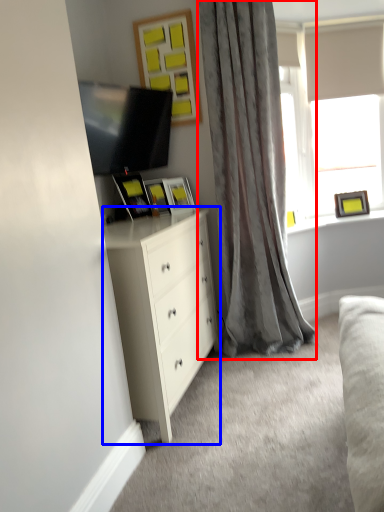
Question: Among these objects, which one is nearest to the camera, curtain (highlighted by a red box) or chest of drawers (highlighted by a blue box)?

Choices:
 (A) curtain
 (B) chest of drawers

Answer: (B)